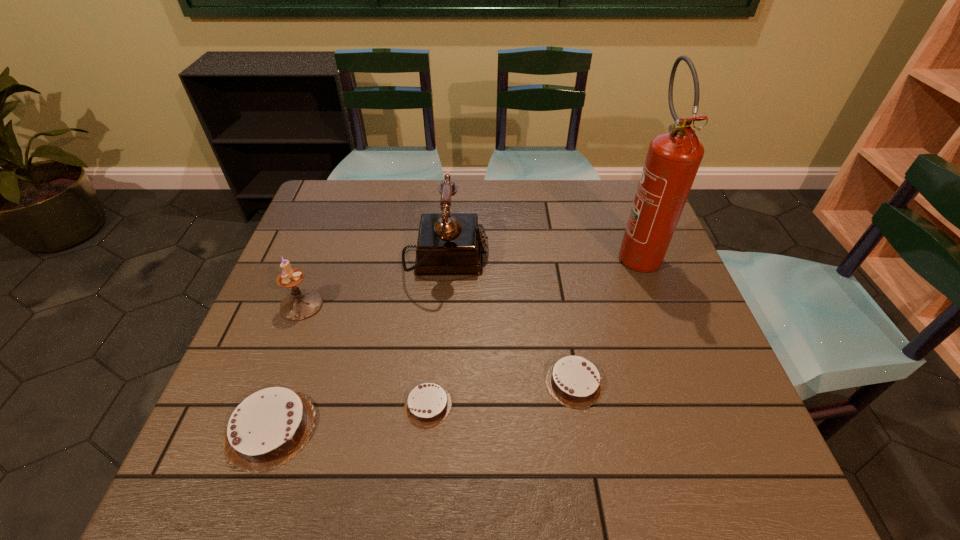
Find the location of `free point that keeps the chocolate cakes evenly spaced on the right`. free point that keeps the chocolate cakes evenly spaced on the right is located at coordinates (708, 362).